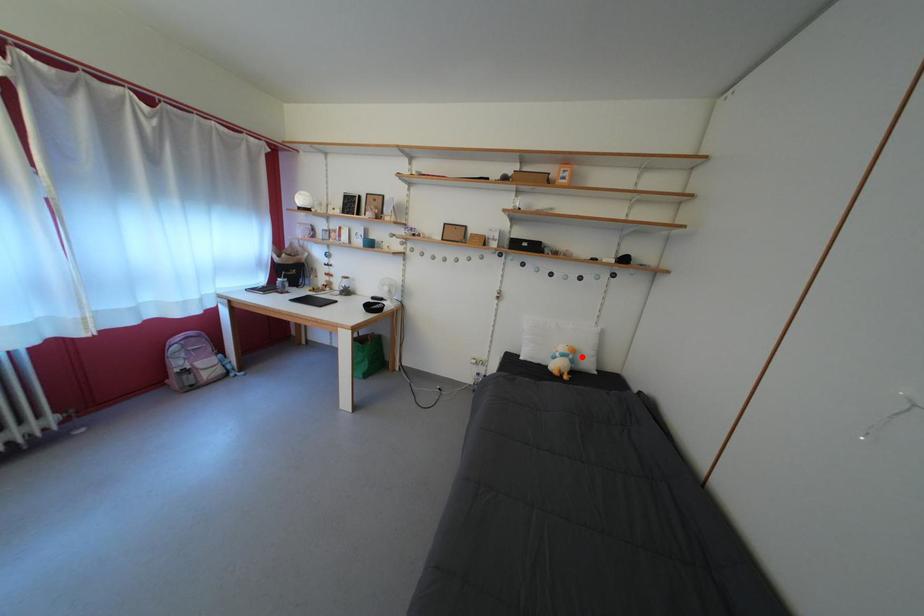
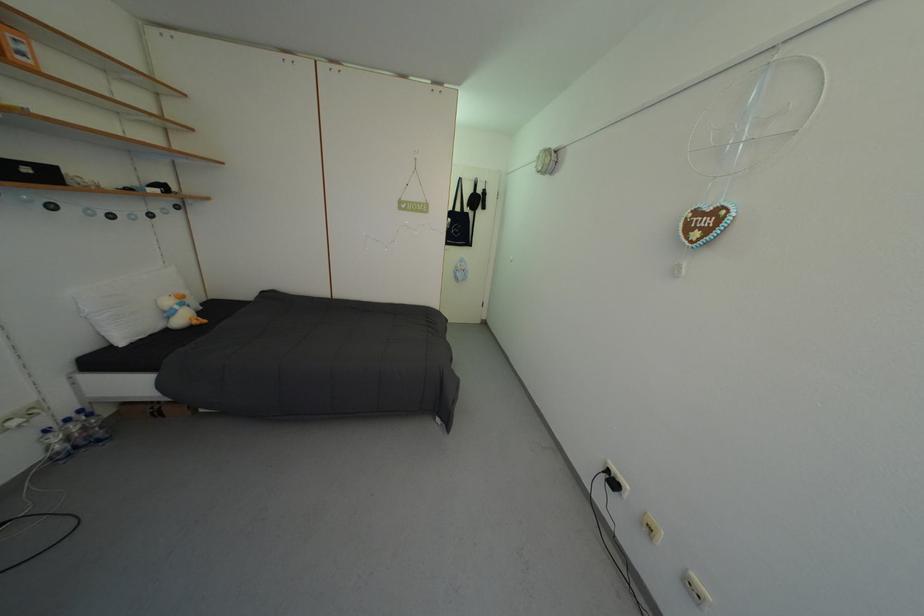
The point at the highlighted location is marked in the first image. Where is the corresponding point in the second image?

(190, 302)